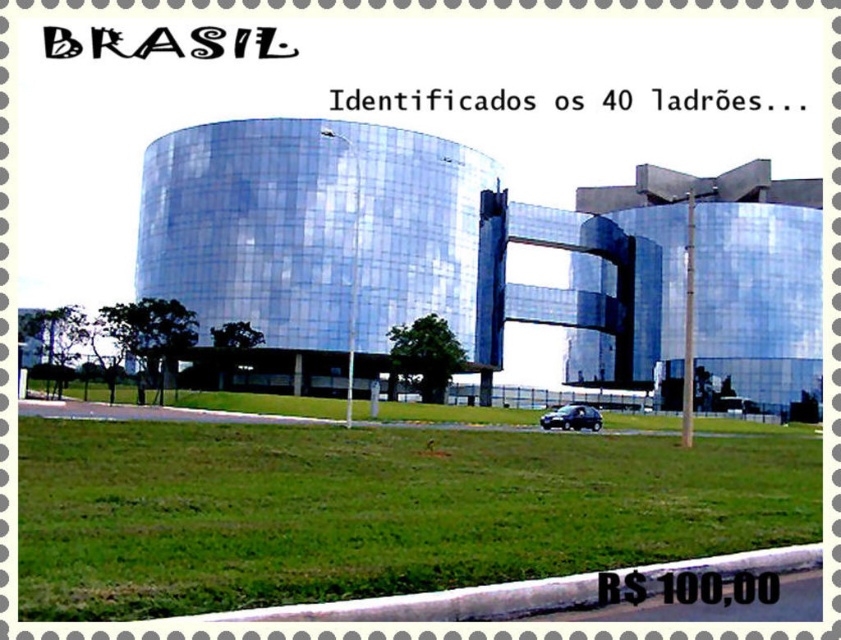
You are a pedestrian standing on the sidewalk. You see the green grass at lower center and the shiny black car at lower center. Which object is closer to you?

The green grass at lower center is closer to you because it is in front of the shiny black car at lower center.

You are a pedestrian standing on the sidewalk in front of the modern building. You see the green grass at lower center and the shiny black car at lower center. Which object is positioned to the left of the other?

The green grass at lower center is to the left of the shiny black car at lower center.

You are a delivery person standing on the sidewalk in front of the modern building. You need to place a large package on the ground. The package is 2 meters wide. Can you place it entirely on the green grass at lower center without overlapping the shiny black car at lower center?

The green grass at lower center might be wider than shiny black car at lower center, so there is a possibility that the green grass at lower center is wide enough to accommodate the 2 meter wide package without overlapping the shiny black car at lower center. However, the exact width is uncertain based on the given information.